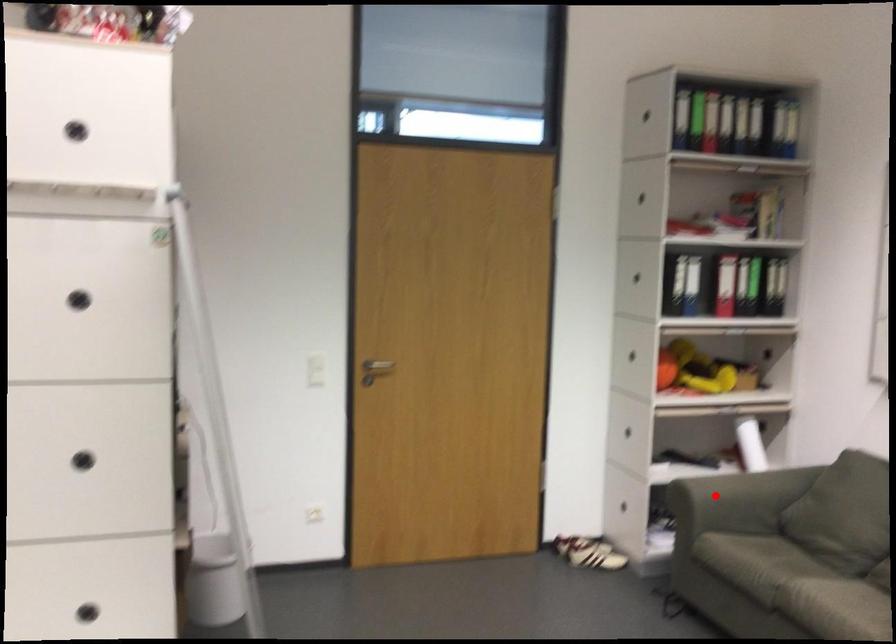
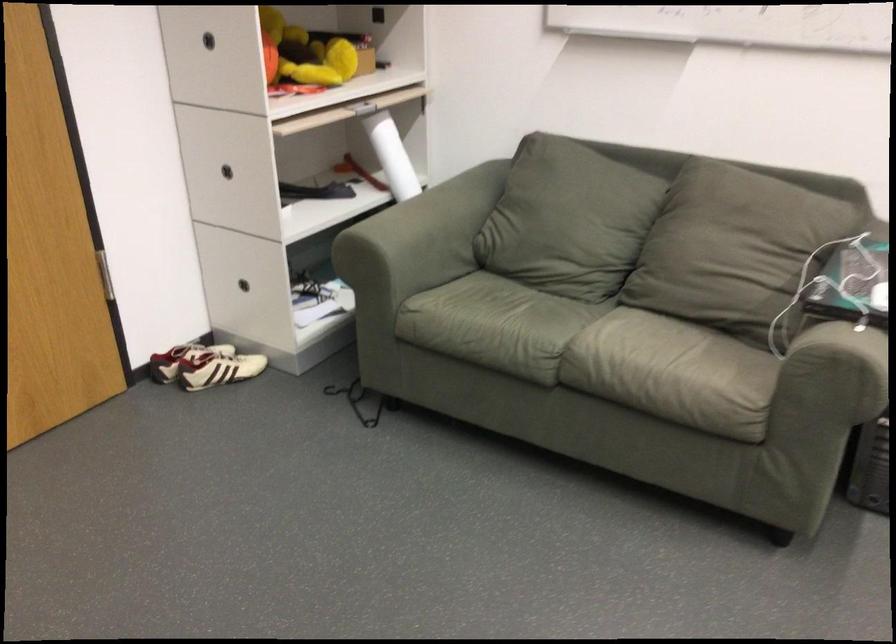
Question: I am providing you with two images of the same scene from different viewpoints. Given a red point in image1, look at the same physical point in image2. Is it:

Choices:
 (A) Closer to the viewpoint
 (B) Farther from the viewpoint

Answer: (A)